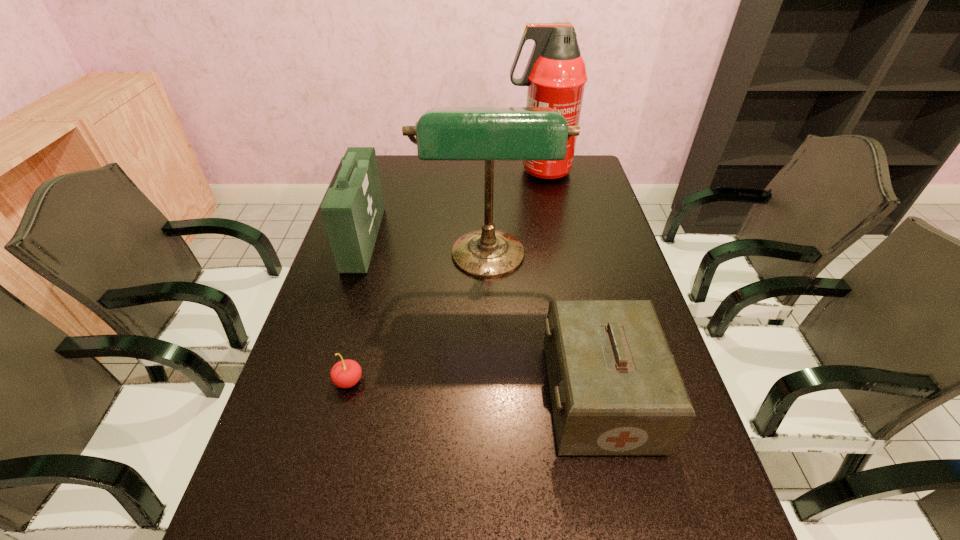
Find the location of a particular element. the farthest object is located at coordinates (555, 74).

Where is `table lamp`? table lamp is located at coordinates [442, 133].

Locate an element on the screen. The width and height of the screenshot is (960, 540). the left first-aid kit is located at coordinates (352, 211).

Identify the location of the farther first-aid kit. (352, 211).

Where is `the right first-aid kit`? the right first-aid kit is located at coordinates [x=615, y=389].

In order to click on the nearer first-aid kit in this screenshot , I will do `click(615, 389)`.

I want to click on cherry, so click(x=346, y=373).

Locate an element on the screen. This screenshot has width=960, height=540. free space located on the trigger side of the fire extinguisher is located at coordinates (469, 171).

Where is `vacant space located on the trigger side of the fire extinguisher`? The image size is (960, 540). vacant space located on the trigger side of the fire extinguisher is located at coordinates (459, 171).

Locate an element on the screen. free space located 0.150m on the trigger side of the fire extinguisher is located at coordinates (467, 171).